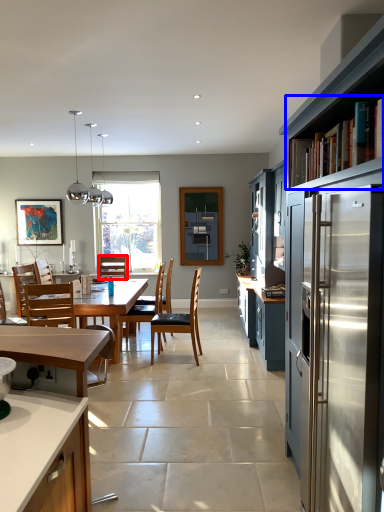
Question: Which point is closer to the camera, chair (highlighted by a red box) or shelf (highlighted by a blue box)?

Choices:
 (A) chair
 (B) shelf

Answer: (B)